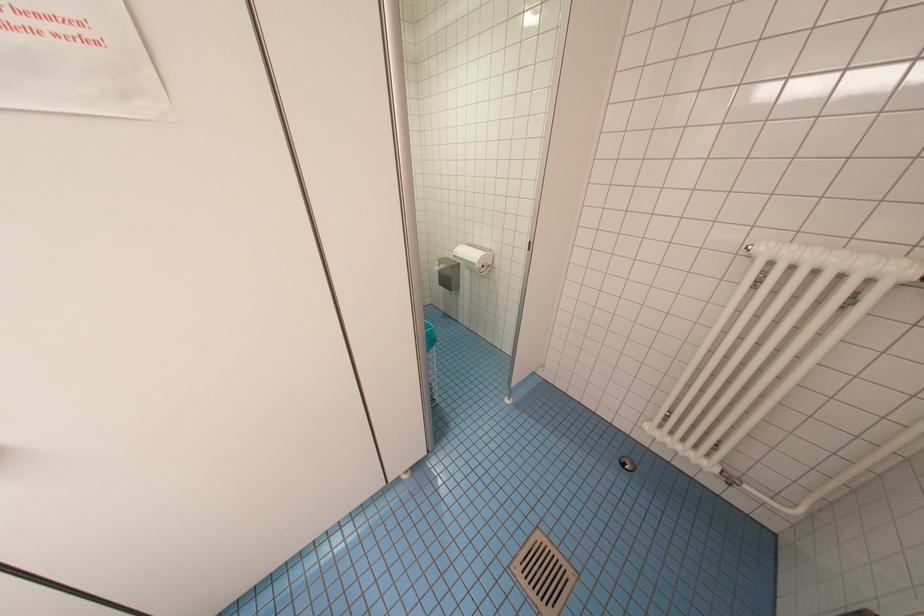
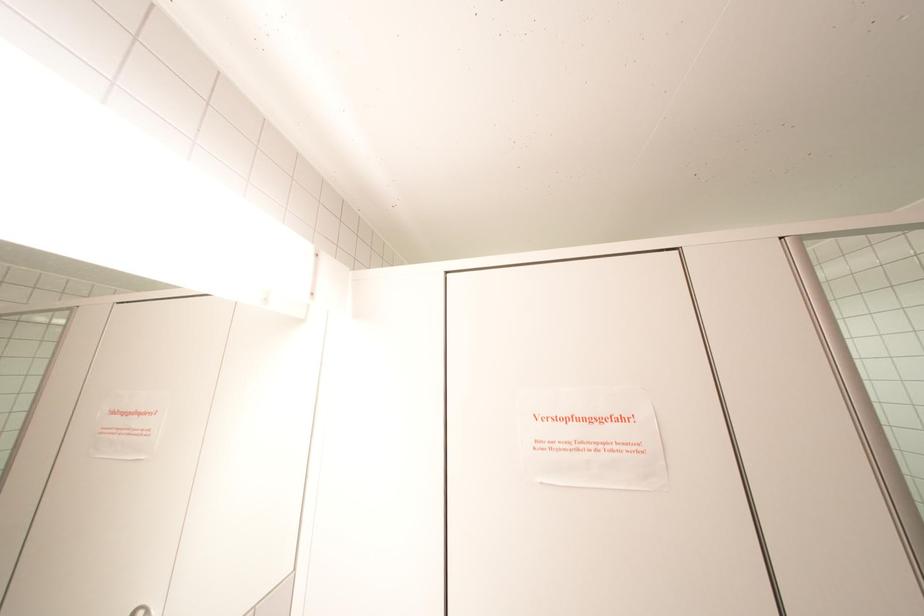
The images are taken continuously from a first-person perspective. In which direction is your viewpoint rotating?

The rotation direction of the camera is left-up.